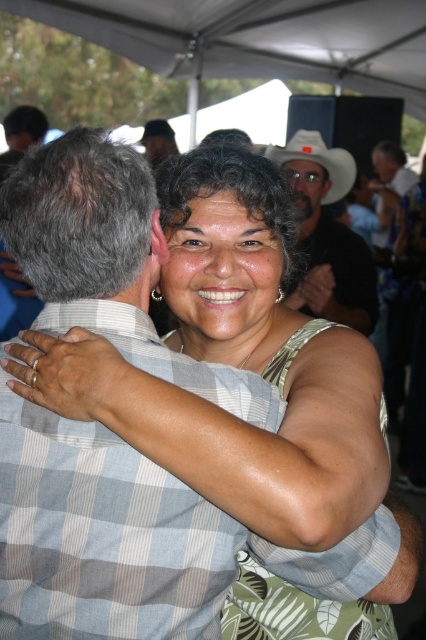
Question: Is white fabric canopy at upper center below white matte cowboy hat at upper center?

Choices:
 (A) no
 (B) yes

Answer: (A)

Question: Which object is farther from the camera taking this photo?

Choices:
 (A) white fabric canopy at upper center
 (B) matte black cowboy hat at upper center
 (C) white matte cowboy hat at upper center

Answer: (A)

Question: Which point is closer to the camera?

Choices:
 (A) (359, 29)
 (B) (279, 148)
 (C) (376, 308)

Answer: (C)

Question: Is white fabric canopy at upper center to the right of white matte cowboy hat at upper center from the viewer's perspective?

Choices:
 (A) no
 (B) yes

Answer: (A)

Question: Which point is closer to the camera taking this photo?

Choices:
 (A) (270, 157)
 (B) (258, 35)
 (C) (307, 269)

Answer: (C)

Question: Does matte black cowboy hat at upper center appear on the right side of white matte cowboy hat at upper center?

Choices:
 (A) no
 (B) yes

Answer: (B)